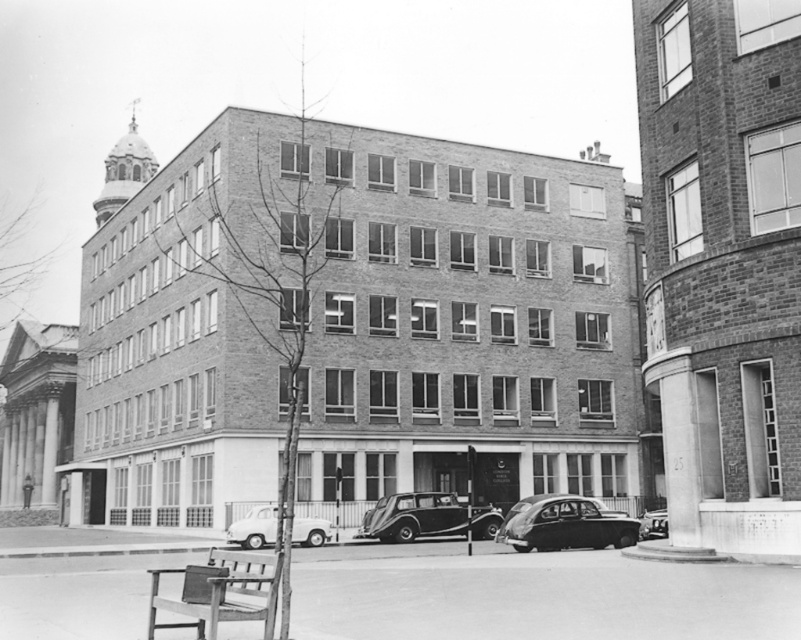
Which is behind, point (256, 582) or point (429, 499)?

The point (429, 499) is more distant.

The height and width of the screenshot is (640, 801). What do you see at coordinates (219, 593) in the screenshot? I see `wooden park bench at lower left` at bounding box center [219, 593].

Which is in front, point (159, 604) or point (421, 536)?

Point (159, 604)

Find the location of `wooden park bench at lower left`. wooden park bench at lower left is located at coordinates (219, 593).

Is shiny black car at center wider than white matte van at lower center?

In fact, shiny black car at center might be narrower than white matte van at lower center.

Which of these two, shiny black car at center or white matte van at lower center, stands taller?

Standing taller between the two is shiny black car at center.

Where is `shiny black car at center`? This screenshot has width=801, height=640. shiny black car at center is located at coordinates (566, 524).

Image resolution: width=801 pixels, height=640 pixels. I want to click on shiny black car at center, so click(566, 524).

Is shiny silver car at center to the right of shiny black car at lower right from the viewer's perspective?

In fact, shiny silver car at center is to the left of shiny black car at lower right.

Is shiny silver car at center wider than shiny black car at lower right?

Indeed, shiny silver car at center has a greater width compared to shiny black car at lower right.

Is point (381, 532) positioned after point (653, 509)?

No, it is in front of (653, 509).

In order to click on shiny silver car at center in this screenshot , I will do `click(425, 516)`.